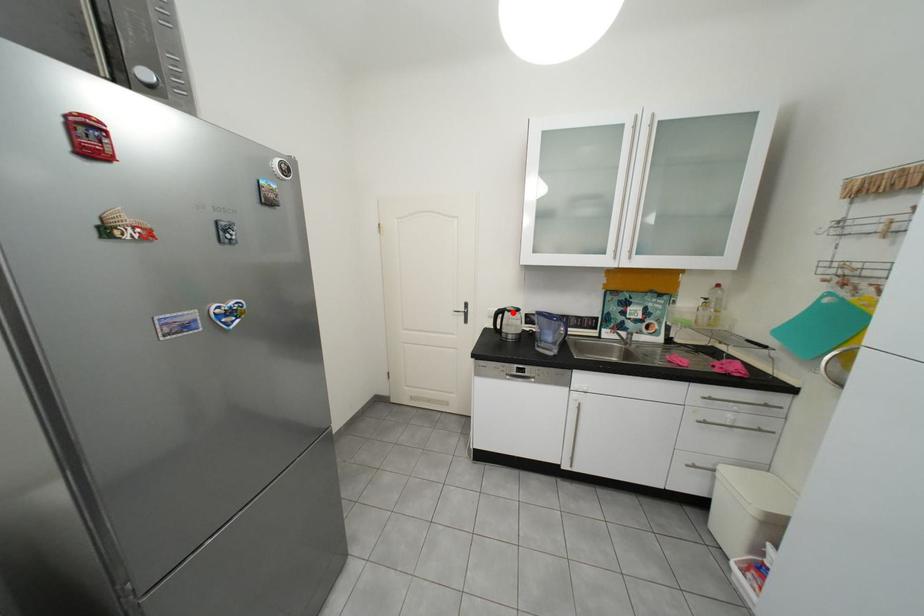
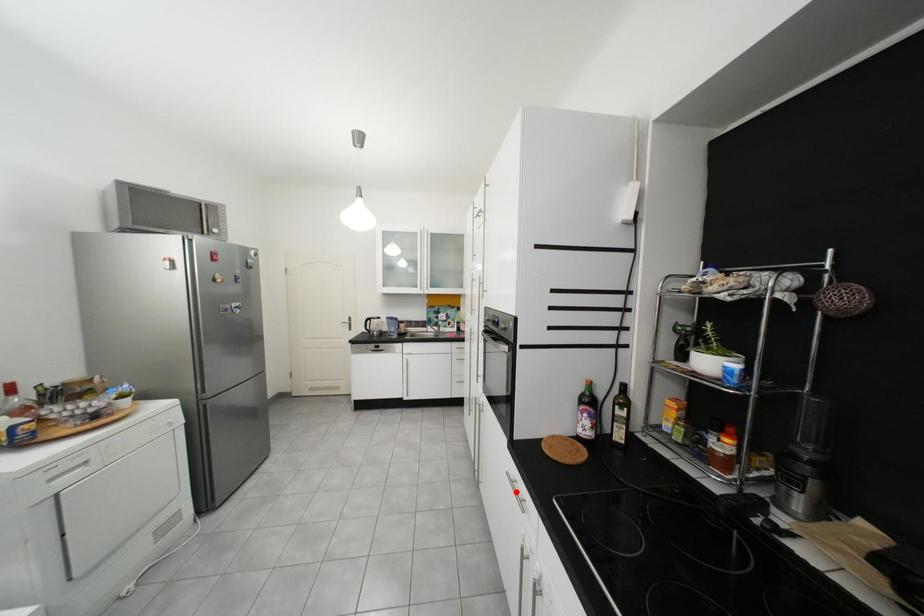
I am providing you with two images of the same scene from different viewpoints. A red point is marked on the first image and another point is marked on the second image. Does the point marked in image1 correspond to the same location as the one in image2?

No